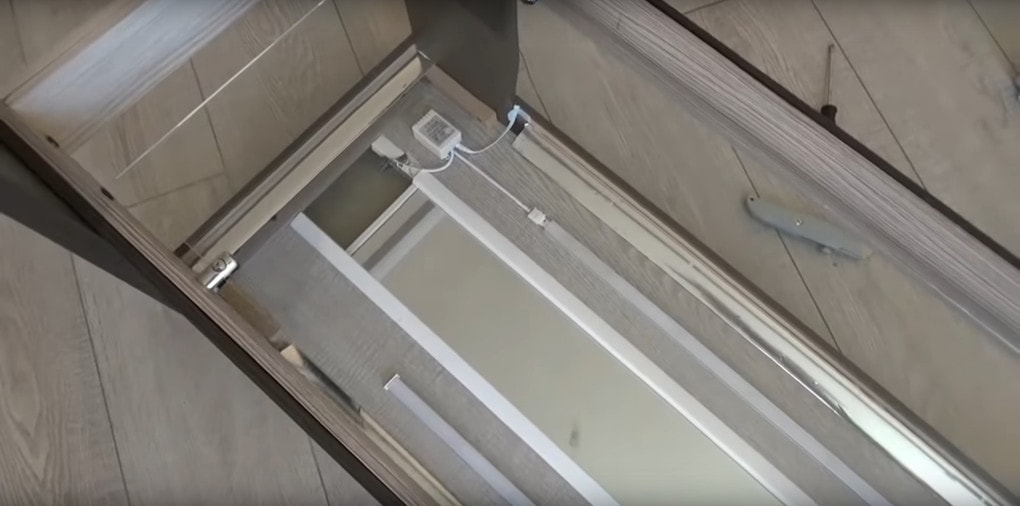
At what (x,y) coordinates should I click in order to perform the action: click on glass. Please return your answer as a coordinate pair (x, y). This screenshot has height=506, width=1020. Looking at the image, I should click on (282, 116), (667, 110).